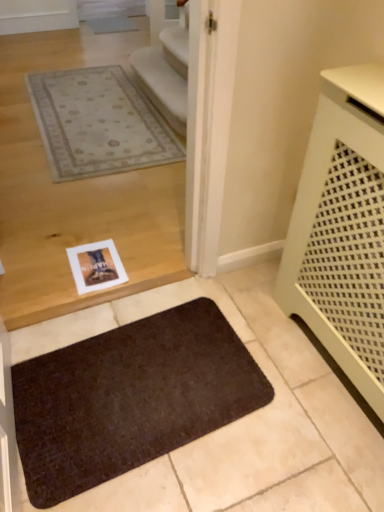
I want to click on vacant space to the right of brown textured mat at lower center, so click(285, 407).